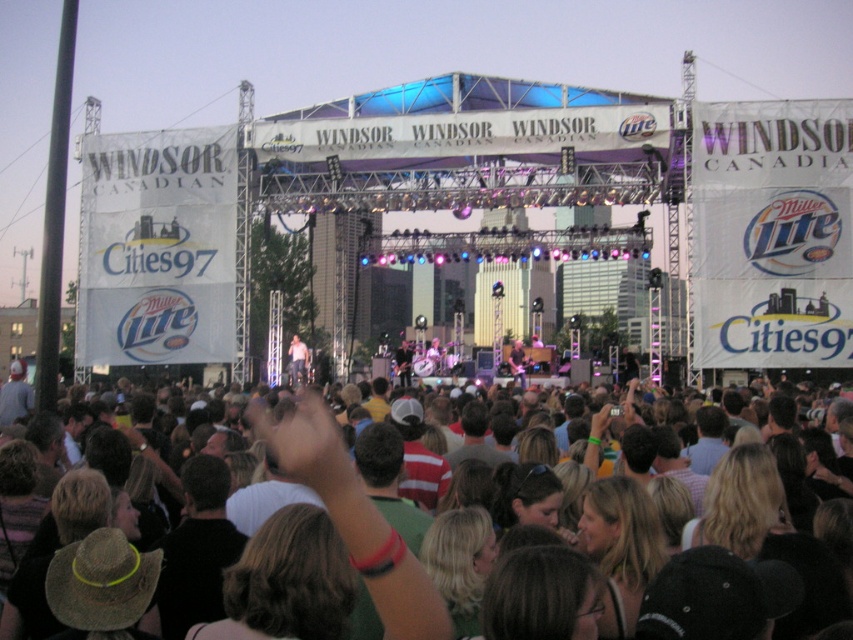
Does dark brown hair at center have a larger size compared to light brown leather jacket at center?

Indeed, dark brown hair at center has a larger size compared to light brown leather jacket at center.

Is point (421, 548) farther from viewer compared to point (302, 348)?

That is False.

Locate an element on the screen. dark brown hair at center is located at coordinates (438, 563).